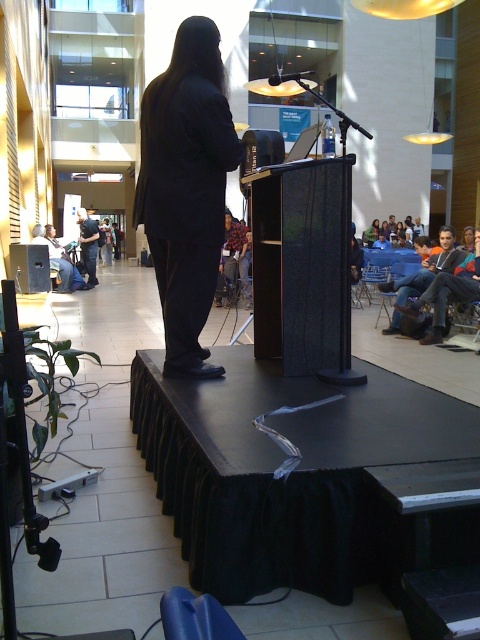
Does denim jacket at center have a lesser width compared to black matte microphone at center?

Correct, denim jacket at center's width is less than black matte microphone at center's.

How much distance is there between denim jacket at center and black matte microphone at center?

The distance of denim jacket at center from black matte microphone at center is 6.22 meters.

Is point (80, 216) positioned behind point (275, 74)?

That is True.

The height and width of the screenshot is (640, 480). I want to click on denim jacket at center, so click(87, 244).

Can you confirm if blue jeans at center is positioned to the left of denim jacket at center?

In fact, blue jeans at center is to the right of denim jacket at center.

Who is lower down, blue jeans at center or denim jacket at center?

blue jeans at center

Who is more distant from viewer, (421, 237) or (78, 211)?

Positioned behind is point (78, 211).

Image resolution: width=480 pixels, height=640 pixels. Identify the location of blue jeans at center. (422, 275).

Is black smooth suit at center shorter than blue jeans at center?

No.

Is black smooth suit at center positioned behind blue jeans at center?

No, black smooth suit at center is in front of blue jeans at center.

Describe the element at coordinates (184, 205) in the screenshot. The width and height of the screenshot is (480, 640). I see `black smooth suit at center` at that location.

Where is `black smooth suit at center`? Image resolution: width=480 pixels, height=640 pixels. black smooth suit at center is located at coordinates (184, 205).